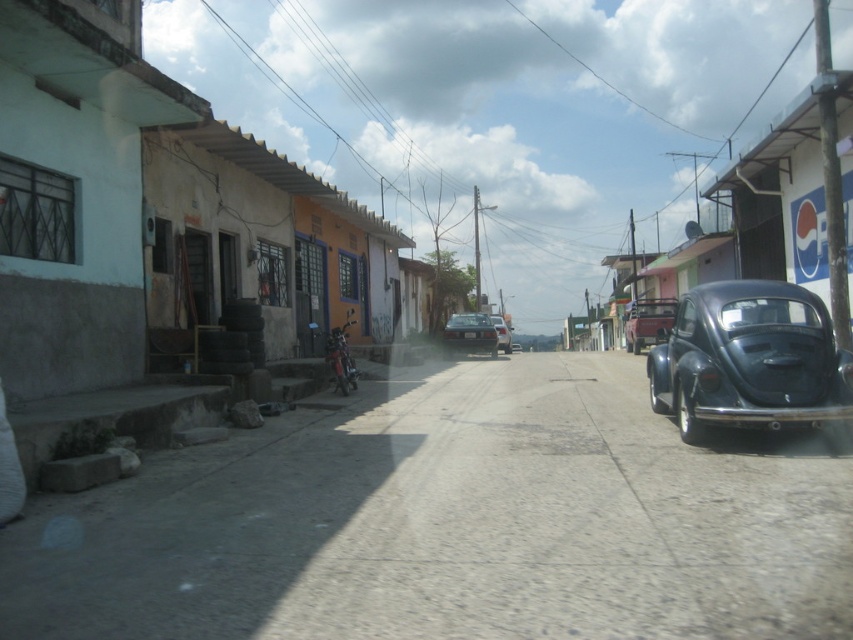
You are driving a glossy dark blue car at right and want to park it in a space that can only accommodate vehicles up to the size of the metallic silver car at center. Can your car fit?

The glossy dark blue car at right is bigger than the metallic silver car at center, so it cannot fit in the parking space designed for the smaller vehicle.

You are a delivery person needing to park your 5.5 meter long truck between the glossy dark blue car at right and the metallic silver car at center. Can you fit your truck in the space between them?

The space between the glossy dark blue car at right and the metallic silver car at center is 14.95 meters. Since your truck is 5.5 meters long, there is sufficient space to park it between them.